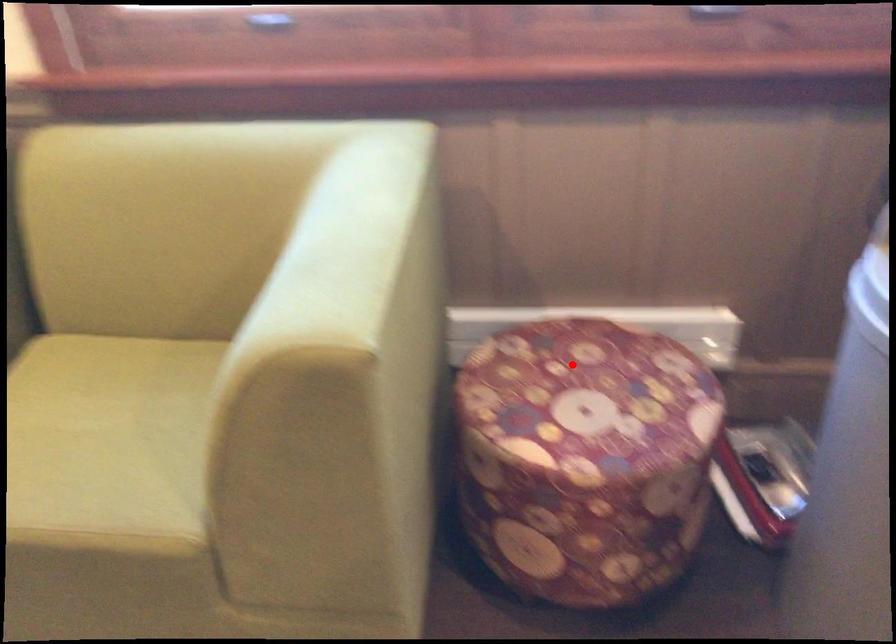
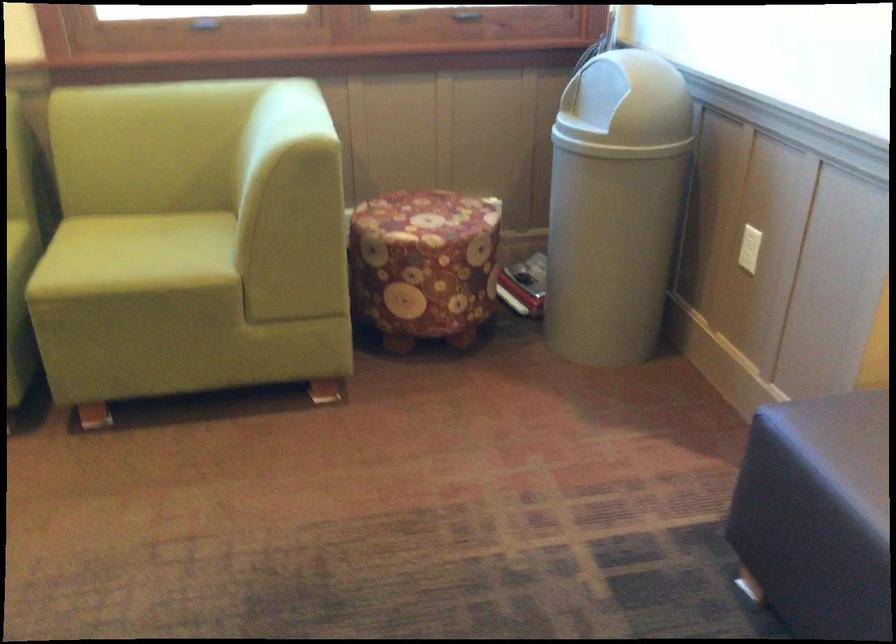
Question: A red point is marked in image1. In image2, is the corresponding 3D point closer to the camera or farther? Reply with the corresponding letter.

Choices:
 (A) The corresponding 3D point is closer.
 (B) The corresponding 3D point is farther.

Answer: (B)